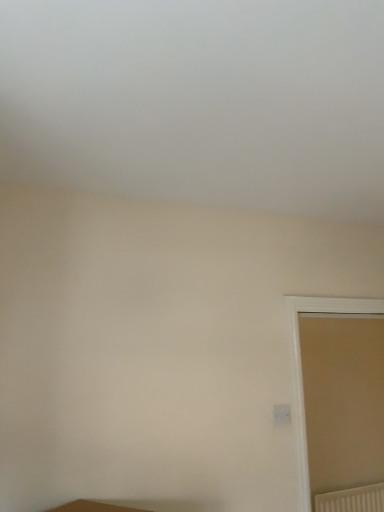
Question: Is beige matte door at right not inside white textured radiator at lower right?

Choices:
 (A) no
 (B) yes

Answer: (B)

Question: From the image's perspective, would you say beige matte door at right is shown under white textured radiator at lower right?

Choices:
 (A) yes
 (B) no

Answer: (B)

Question: From the image's perspective, is beige matte door at right located above white textured radiator at lower right?

Choices:
 (A) yes
 (B) no

Answer: (A)

Question: From a real-world perspective, does beige matte door at right sit lower than white textured radiator at lower right?

Choices:
 (A) no
 (B) yes

Answer: (A)

Question: Is beige matte door at right positioned with its back to white textured radiator at lower right?

Choices:
 (A) no
 (B) yes

Answer: (A)

Question: Is the depth of beige matte door at right less than that of white textured radiator at lower right?

Choices:
 (A) no
 (B) yes

Answer: (B)

Question: Does white textured radiator at lower right have a smaller size compared to beige matte door at right?

Choices:
 (A) yes
 (B) no

Answer: (A)

Question: Can you confirm if white textured radiator at lower right is thinner than beige matte door at right?

Choices:
 (A) no
 (B) yes

Answer: (B)

Question: Is white textured radiator at lower right turned away from beige matte door at right?

Choices:
 (A) no
 (B) yes

Answer: (A)

Question: Considering the relative positions of white textured radiator at lower right and beige matte door at right in the image provided, is white textured radiator at lower right behind beige matte door at right?

Choices:
 (A) yes
 (B) no

Answer: (A)

Question: From a real-world perspective, is white textured radiator at lower right on top of beige matte door at right?

Choices:
 (A) yes
 (B) no

Answer: (B)

Question: From the image's perspective, is white textured radiator at lower right under beige matte door at right?

Choices:
 (A) yes
 (B) no

Answer: (A)

Question: In the image, is beige matte door at right on the left side or the right side of white textured radiator at lower right?

Choices:
 (A) right
 (B) left

Answer: (B)